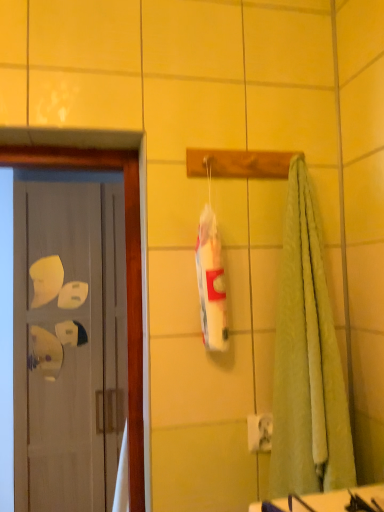
Question: Is white glossy counter top at lower right at the right side of white glossy door at left?

Choices:
 (A) no
 (B) yes

Answer: (B)

Question: Considering the relative sizes of white glossy counter top at lower right and white glossy door at left in the image provided, is white glossy counter top at lower right shorter than white glossy door at left?

Choices:
 (A) no
 (B) yes

Answer: (B)

Question: Is white glossy door at left located within white glossy counter top at lower right?

Choices:
 (A) yes
 (B) no

Answer: (B)

Question: Is white glossy counter top at lower right at the left side of white glossy door at left?

Choices:
 (A) yes
 (B) no

Answer: (B)

Question: From a real-world perspective, is white glossy counter top at lower right below white glossy door at left?

Choices:
 (A) no
 (B) yes

Answer: (A)

Question: Are white glossy counter top at lower right and white glossy door at left located far from each other?

Choices:
 (A) yes
 (B) no

Answer: (B)

Question: From a real-world perspective, is white glossy door at left positioned under white glossy counter top at lower right based on gravity?

Choices:
 (A) yes
 (B) no

Answer: (A)

Question: Is white glossy door at left bigger than white glossy counter top at lower right?

Choices:
 (A) no
 (B) yes

Answer: (B)

Question: Does white glossy door at left have a greater width compared to white glossy counter top at lower right?

Choices:
 (A) no
 (B) yes

Answer: (B)

Question: Can we say white glossy door at left lies outside white glossy counter top at lower right?

Choices:
 (A) yes
 (B) no

Answer: (A)

Question: Does white glossy door at left have a lesser width compared to white glossy counter top at lower right?

Choices:
 (A) no
 (B) yes

Answer: (A)

Question: From the image's perspective, is white glossy door at left under white glossy counter top at lower right?

Choices:
 (A) yes
 (B) no

Answer: (A)

Question: Looking at the image, does white glossy counter top at lower right seem bigger or smaller compared to white glossy door at left?

Choices:
 (A) small
 (B) big

Answer: (A)